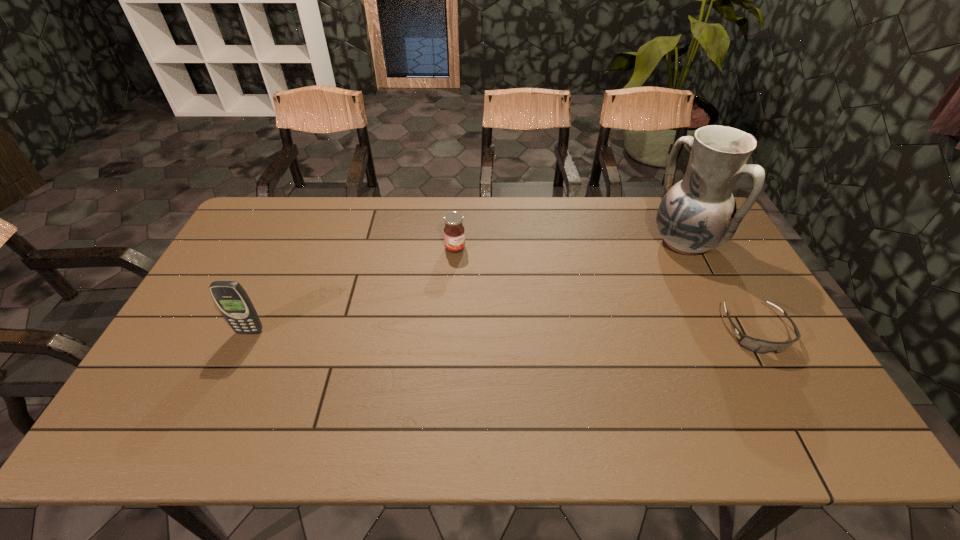
Find the location of a particular element. This screenshot has width=960, height=540. the leftmost object is located at coordinates (230, 297).

Locate an element on the screen. This screenshot has width=960, height=540. the third shortest object is located at coordinates (230, 297).

Locate an element on the screen. the shortest object is located at coordinates (760, 346).

Locate an element on the screen. the second object from left to right is located at coordinates (454, 232).

The image size is (960, 540). What are the coordinates of `the third tallest object` in the screenshot? It's located at [454, 232].

Locate an element on the screen. This screenshot has width=960, height=540. the tallest object is located at coordinates (698, 214).

Where is `vacant space located on the screen of the cellular telephone`? vacant space located on the screen of the cellular telephone is located at coordinates (218, 401).

In order to click on vacant region located 0.070m on the lenses of the goggles in this screenshot , I will do `click(783, 381)`.

The image size is (960, 540). I want to click on vacant area located on the label side of the jam, so click(x=497, y=300).

Where is `free space located on the label side of the jam`? free space located on the label side of the jam is located at coordinates (489, 289).